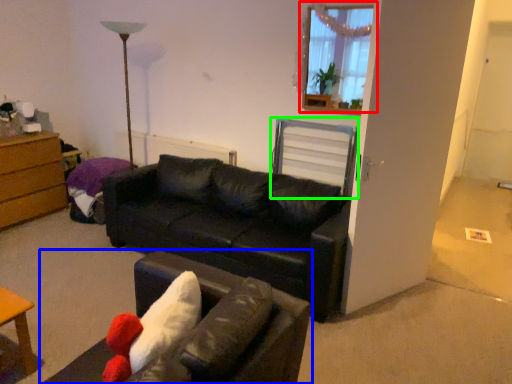
Question: Which is farther away from window (highlighted by a red box)? studio couch (highlighted by a blue box) or swivel chair (highlighted by a green box)?

Choices:
 (A) studio couch
 (B) swivel chair

Answer: (A)